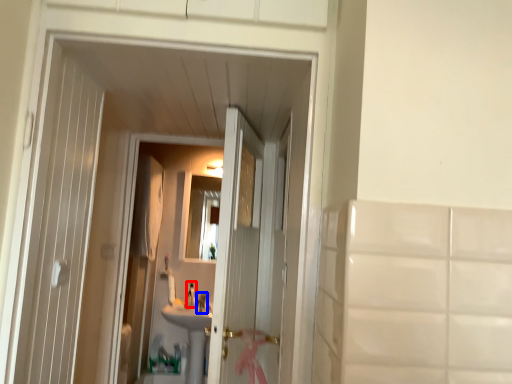
Question: Which point is closer to the camera, faucet (highlighted by a red box) or faucet (highlighted by a blue box)?

Choices:
 (A) faucet
 (B) faucet

Answer: (B)